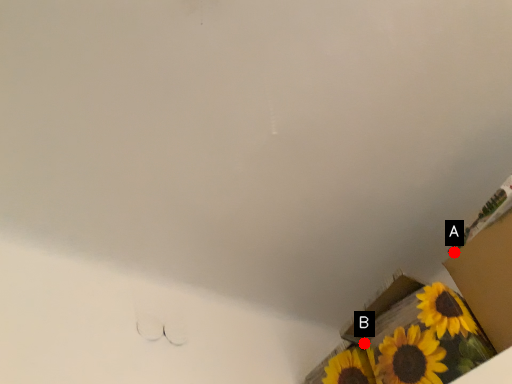
Question: Two points are circled on the image, labeled by A and B beside each circle. Which point is farther to the camera?

Choices:
 (A) A is further
 (B) B is further

Answer: (B)